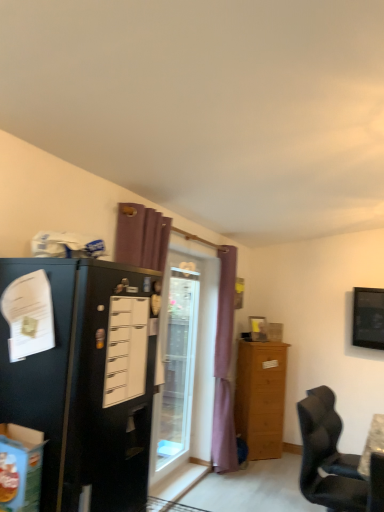
Question: Considering the positions of point (357, 344) and point (81, 357), is point (357, 344) closer or farther from the camera than point (81, 357)?

Choices:
 (A) closer
 (B) farther

Answer: (B)

Question: In terms of size, does black glossy tv at upper right appear bigger or smaller than black matte refrigerator at left?

Choices:
 (A) big
 (B) small

Answer: (B)

Question: Estimate the real-world distances between objects in this image. Which object is farther from the black matte refrigerator at left?

Choices:
 (A) wooden picture frame at upper center
 (B) transparent glass door at center
 (C) black glossy tv at upper right
 (D) green cardboard box at lower left
 (E) white matte drawer at left

Answer: (C)

Question: Estimate the real-world distances between objects in this image. Which object is closer to the white matte drawer at left?

Choices:
 (A) wooden picture frame at upper center
 (B) light brown wooden cabinet at right
 (C) transparent glass door at center
 (D) purple fabric curtain at center
 (E) black leather chair at lower right

Answer: (E)